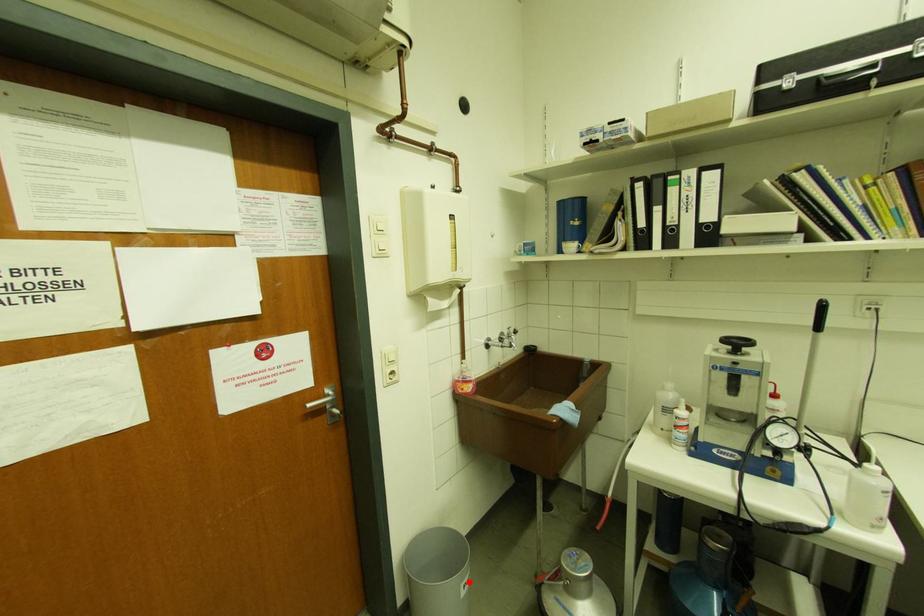
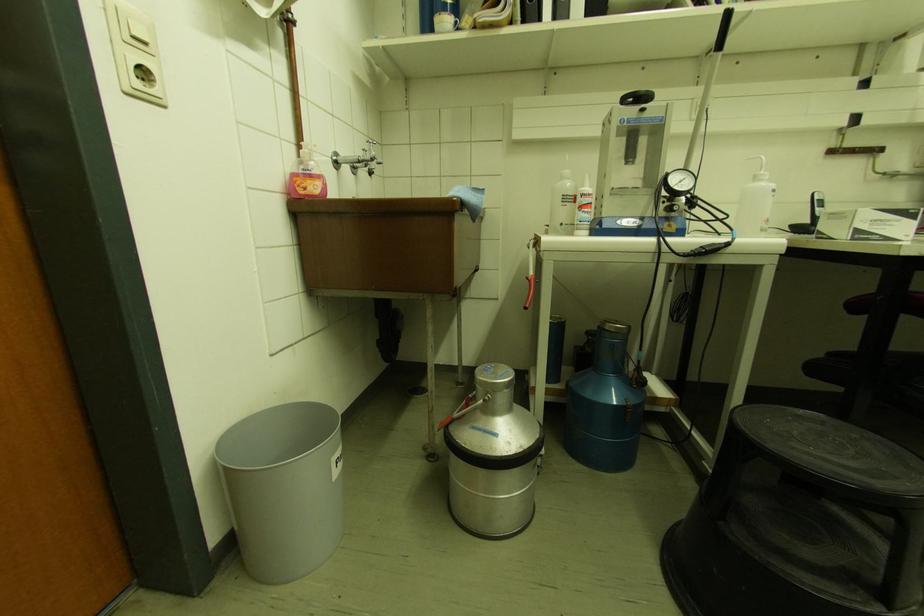
Question: I am providing you with two images of the same scene from different viewpoints. Given a red point in image1, look at the same physical point in image2. Is it:

Choices:
 (A) Closer to the viewpoint
 (B) Farther from the viewpoint

Answer: (B)